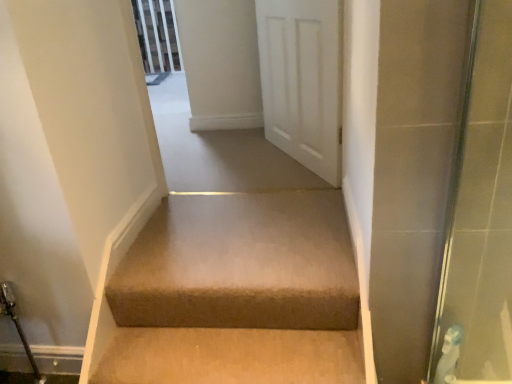
Image resolution: width=512 pixels, height=384 pixels. What do you see at coordinates (302, 81) in the screenshot?
I see `white matte door at center` at bounding box center [302, 81].

Locate an element on the screen. This screenshot has width=512, height=384. white matte door at center is located at coordinates (302, 81).

Identify the location of white matte door at center. This screenshot has height=384, width=512. pos(302,81).